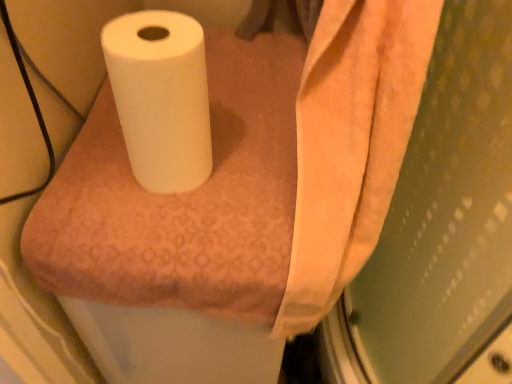
Question: Which is correct: white matte paper towel at center is inside white matte toilet paper at center, or outside of it?

Choices:
 (A) inside
 (B) outside

Answer: (B)

Question: Is white matte paper towel at center in front of or behind white matte toilet paper at center in the image?

Choices:
 (A) front
 (B) behind

Answer: (B)

Question: In the image, is white matte paper towel at center on the left side or the right side of white matte toilet paper at center?

Choices:
 (A) left
 (B) right

Answer: (B)

Question: Do you think white matte toilet paper at center is within white matte paper towel at center, or outside of it?

Choices:
 (A) inside
 (B) outside

Answer: (B)

Question: Considering the positions of white matte toilet paper at center and white matte paper towel at center in the image, is white matte toilet paper at center bigger or smaller than white matte paper towel at center?

Choices:
 (A) big
 (B) small

Answer: (B)

Question: In the image, is white matte toilet paper at center on the left side or the right side of white matte paper towel at center?

Choices:
 (A) left
 (B) right

Answer: (A)

Question: From a real-world perspective, is white matte toilet paper at center physically located above or below white matte paper towel at center?

Choices:
 (A) above
 (B) below

Answer: (A)